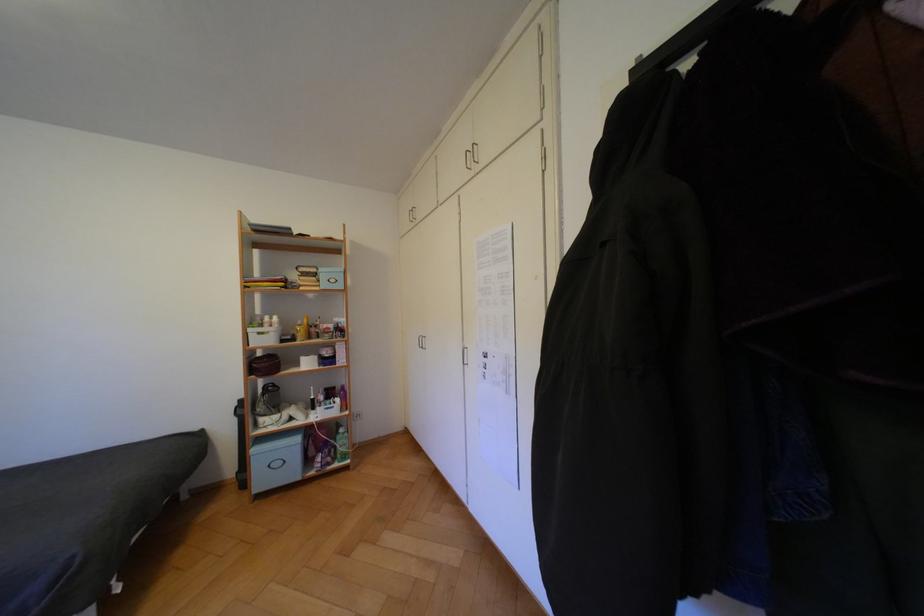
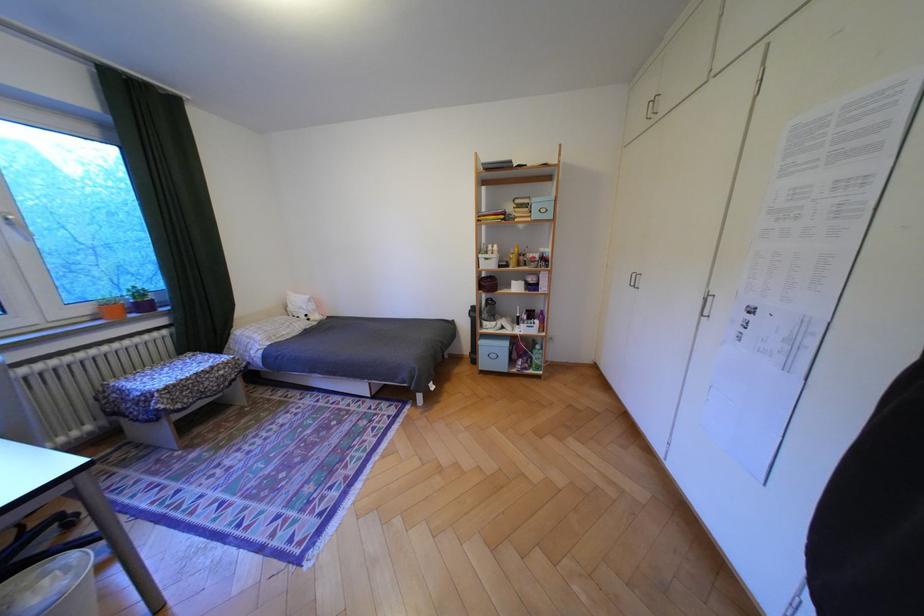
Where in the second image is the point corresponding to (343,392) from the first image?

(542, 315)